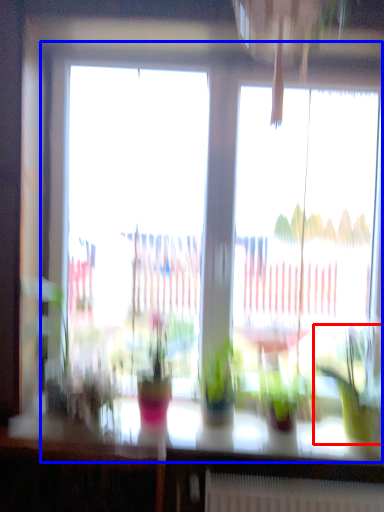
Question: Which object appears farthest to the camera in this image, houseplant (highlighted by a red box) or window (highlighted by a blue box)?

Choices:
 (A) houseplant
 (B) window

Answer: (B)